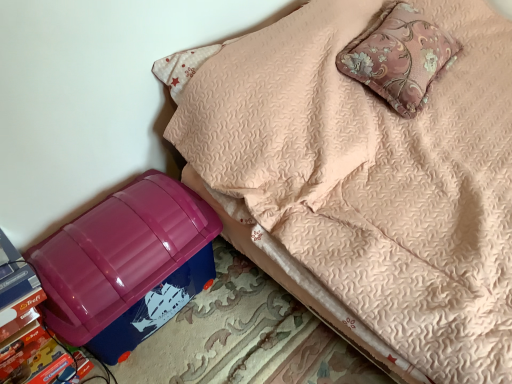
Question: In terms of size, does glossy plastic storage box at lower left appear bigger or smaller than pink floral cushion at upper right?

Choices:
 (A) big
 (B) small

Answer: (A)

Question: In the image, is glossy plastic storage box at lower left positioned in front of or behind pink floral cushion at upper right?

Choices:
 (A) front
 (B) behind

Answer: (A)

Question: Which object is the farthest from the glossy plastic storage box at lower left?

Choices:
 (A) blue plastic storage bin at lower left
 (B) pink floral cushion at upper right

Answer: (B)

Question: Which object is the closest to the blue plastic storage bin at lower left?

Choices:
 (A) glossy plastic storage box at lower left
 (B) pink floral cushion at upper right

Answer: (B)